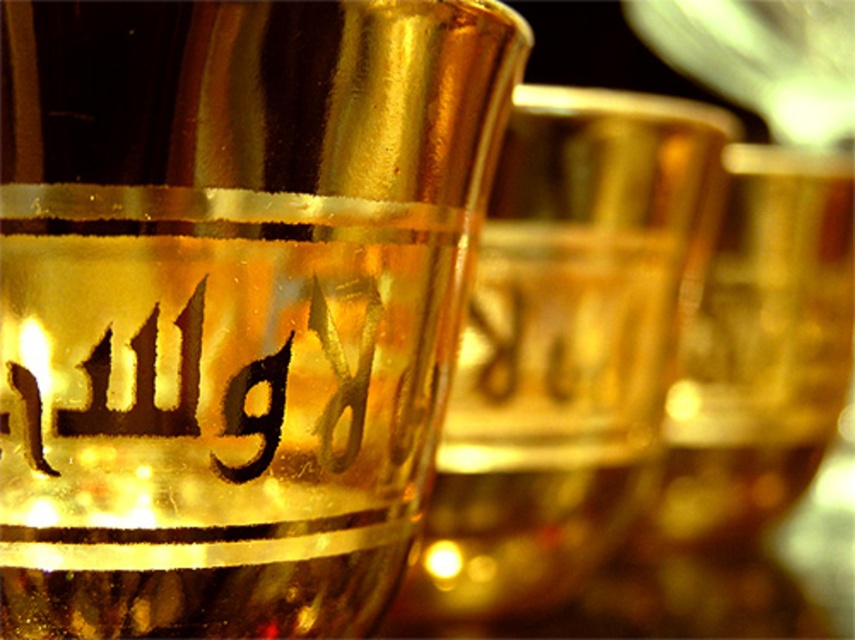
You have a small sticker that is 1 inch wide. You want to place it between the shiny gold glass at center and the gold metallic beer glass at center. Is there enough space to fit the sticker without overlapping either glass?

The distance between the shiny gold glass at center and the gold metallic beer glass at center is 3.37 inches. Since the sticker is only 1 inch wide, there is enough space to fit it between them without overlapping either glass.

You are at a bar and see two glasses in front of you. One is the shiny gold glass at center and the other is the gold metallic beer glass at center. Which one is positioned to the left?

The shiny gold glass at center is positioned to the left of the gold metallic beer glass at center.